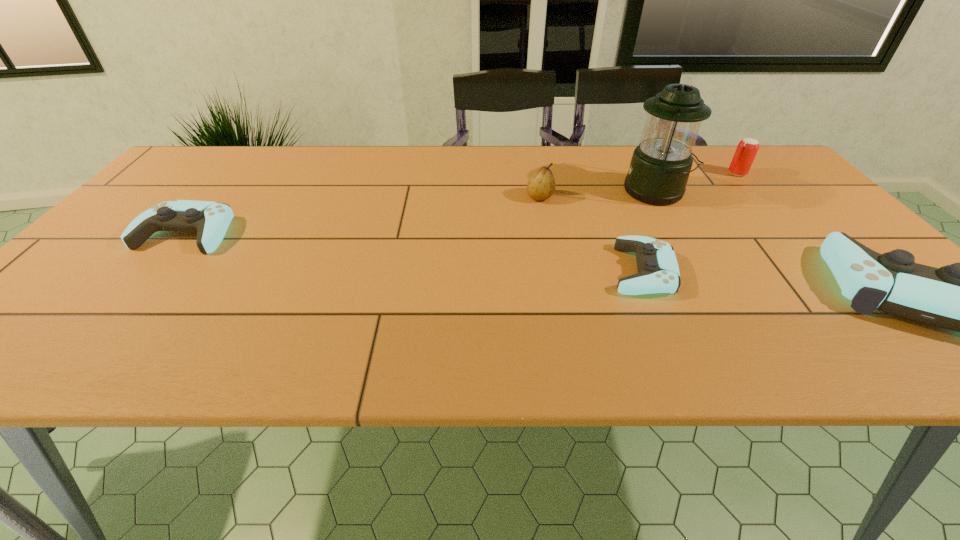
Where is `the leftmost control`? the leftmost control is located at coordinates (210, 220).

The width and height of the screenshot is (960, 540). Identify the location of the leftmost object. (210, 220).

At what (x,y) coordinates should I click in order to perform the action: click on the shortest control. Please return your answer as a coordinate pair (x, y). This screenshot has height=540, width=960. Looking at the image, I should click on (658, 272).

Where is `the shortest object`? The image size is (960, 540). the shortest object is located at coordinates (658, 272).

I want to click on beer can, so click(747, 148).

Find the location of a particular element. The height and width of the screenshot is (540, 960). the tallest object is located at coordinates (660, 166).

This screenshot has width=960, height=540. Find the location of `pear`. pear is located at coordinates coord(541,185).

You are a GUI agent. You are given a task and a screenshot of the screen. Output one action in this format:
    pyautogui.click(x=<x>, y=<y>)
    Task: Click on the vacant space located 0.230m on the back of the leftmost control
    
    Given the screenshot: What is the action you would take?
    pyautogui.click(x=238, y=170)

In order to click on vacant space situated on the right of the shortest object in this screenshot , I will do `click(821, 270)`.

This screenshot has height=540, width=960. In order to click on vacant space located 0.160m on the front of the beer can in this screenshot , I will do `click(768, 208)`.